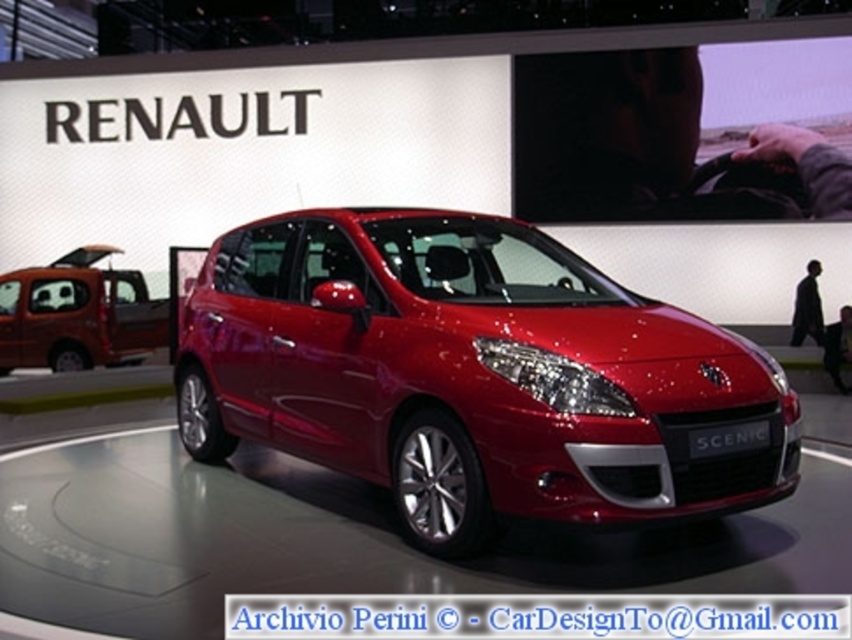
What do you see at coordinates (473, 374) in the screenshot? I see `glossy red car at center` at bounding box center [473, 374].

Can you confirm if glossy red car at center is positioned to the left of matte orange van at left?

Incorrect, glossy red car at center is not on the left side of matte orange van at left.

The width and height of the screenshot is (852, 640). Find the location of `glossy red car at center`. glossy red car at center is located at coordinates (473, 374).